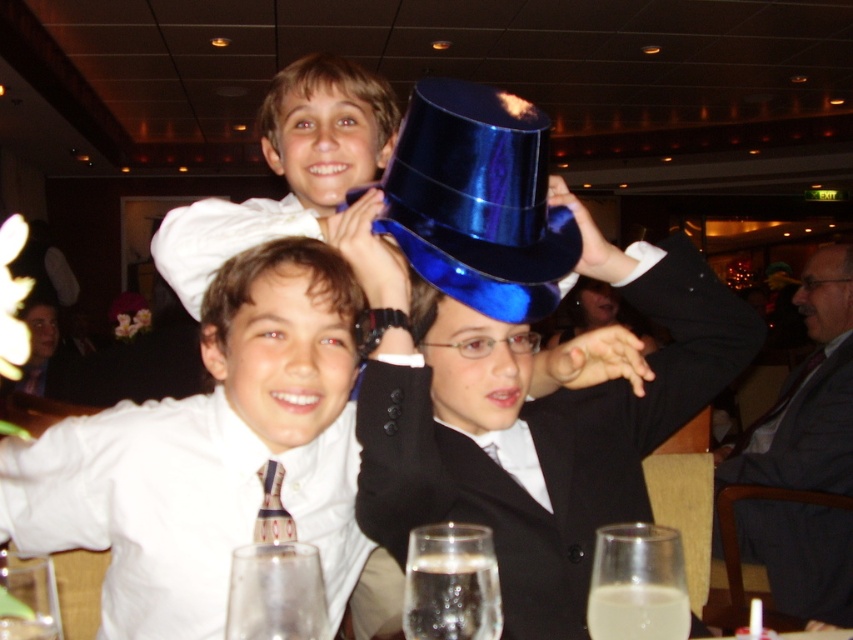
The height and width of the screenshot is (640, 853). I want to click on gray wool suit at right, so click(807, 396).

Does gray wool suit at right have a greater width compared to patterned silk tie at center?

Correct, the width of gray wool suit at right exceeds that of patterned silk tie at center.

Where is `gray wool suit at right`? The height and width of the screenshot is (640, 853). gray wool suit at right is located at coordinates (807, 396).

Where is `gray wool suit at right`? The height and width of the screenshot is (640, 853). gray wool suit at right is located at coordinates (807, 396).

Is gray wool suit at right taller than matte white shirt at center?

A: Indeed, gray wool suit at right has a greater height compared to matte white shirt at center.

What do you see at coordinates (807, 396) in the screenshot?
I see `gray wool suit at right` at bounding box center [807, 396].

At what (x,y) coordinates should I click in order to perform the action: click on gray wool suit at right. Please return your answer as a coordinate pair (x, y). Looking at the image, I should click on (807, 396).

Describe the element at coordinates (282, 337) in the screenshot. I see `matte white shirt at center` at that location.

Is point (258, 252) positioned in front of point (386, 144)?

Yes, point (258, 252) is in front of point (386, 144).

The height and width of the screenshot is (640, 853). What do you see at coordinates (282, 337) in the screenshot?
I see `matte white shirt at center` at bounding box center [282, 337].

Find the location of a particular element. This screenshot has width=853, height=640. matte white shirt at center is located at coordinates (282, 337).